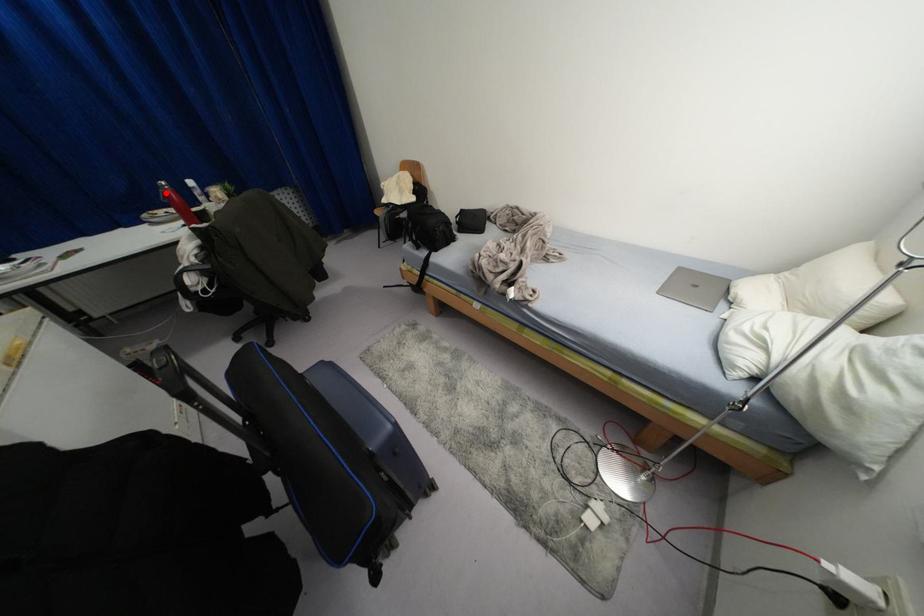
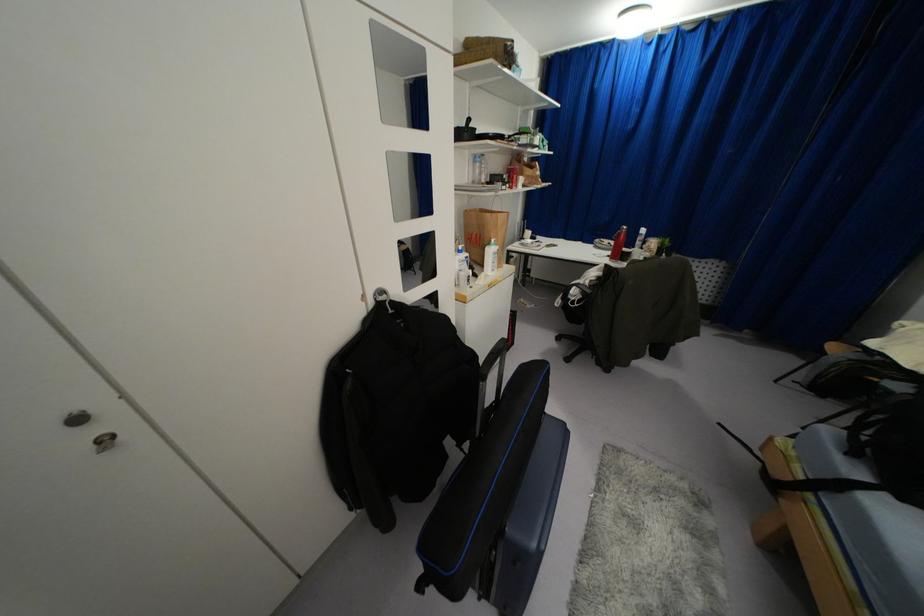
Where in the second image is the point corresponding to the highlighted location from the first image?

(618, 233)